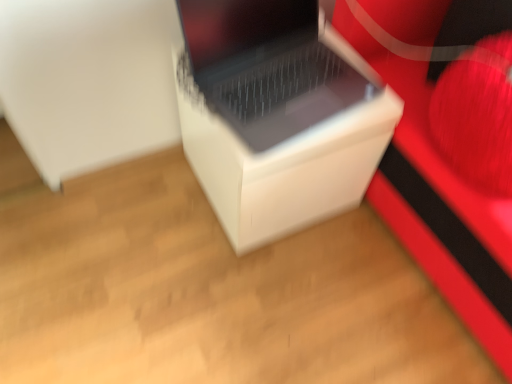
Image resolution: width=512 pixels, height=384 pixels. In order to click on free point above white matte cardboard box at center (from a real-world perspective) in this screenshot , I will do `click(298, 84)`.